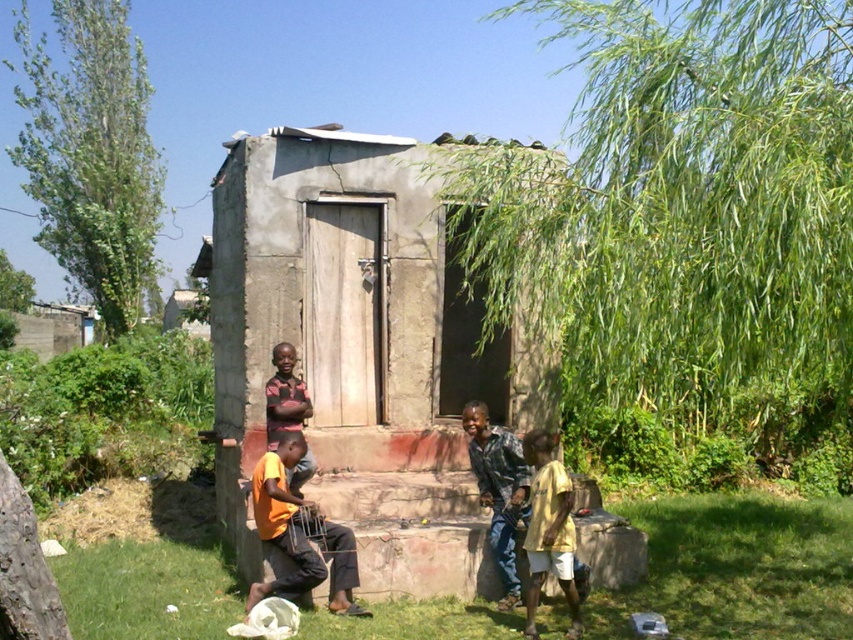
Question: Does green leafy tree at upper right have a greater width compared to orange cotton shirt at lower center?

Choices:
 (A) yes
 (B) no

Answer: (A)

Question: Observing the image, what is the correct spatial positioning of green leafy tree at upper left in reference to orange t-shirt at center?

Choices:
 (A) above
 (B) below

Answer: (A)

Question: Does dark blue jeans at center appear on the left side of orange t-shirt at center?

Choices:
 (A) yes
 (B) no

Answer: (B)

Question: Which object appears closest to the camera in this image?

Choices:
 (A) green leafy tree at upper left
 (B) dark blue jeans at center
 (C) green grass at lower center

Answer: (B)

Question: Which object is farther from the camera taking this photo?

Choices:
 (A) orange cotton shirt at lower center
 (B) yellow matte shirt at lower right
 (C) green grass at lower center
 (D) dark blue jeans at center

Answer: (C)

Question: Which point appears farthest from the camera in this image?

Choices:
 (A) coord(282,360)
 (B) coord(569,540)
 (C) coord(68,214)

Answer: (C)